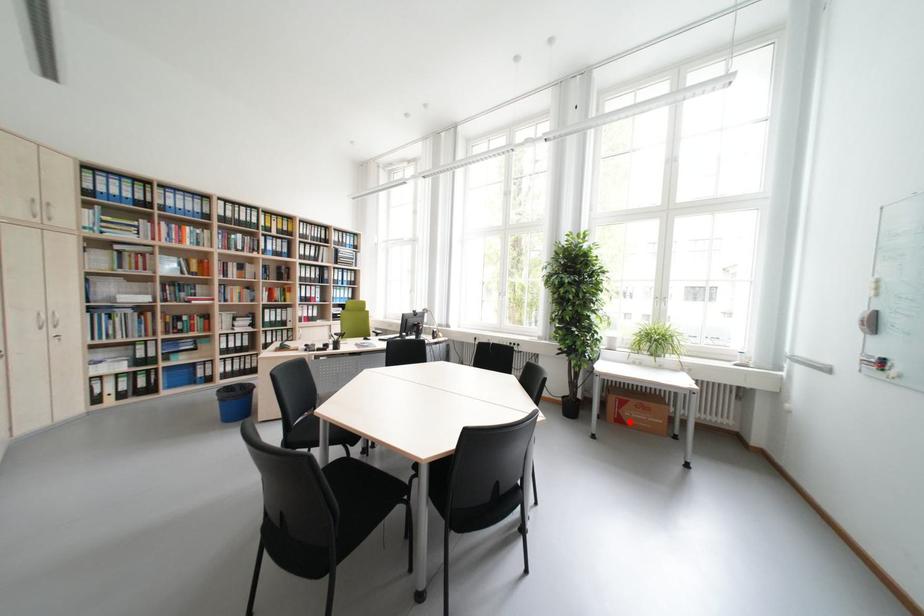
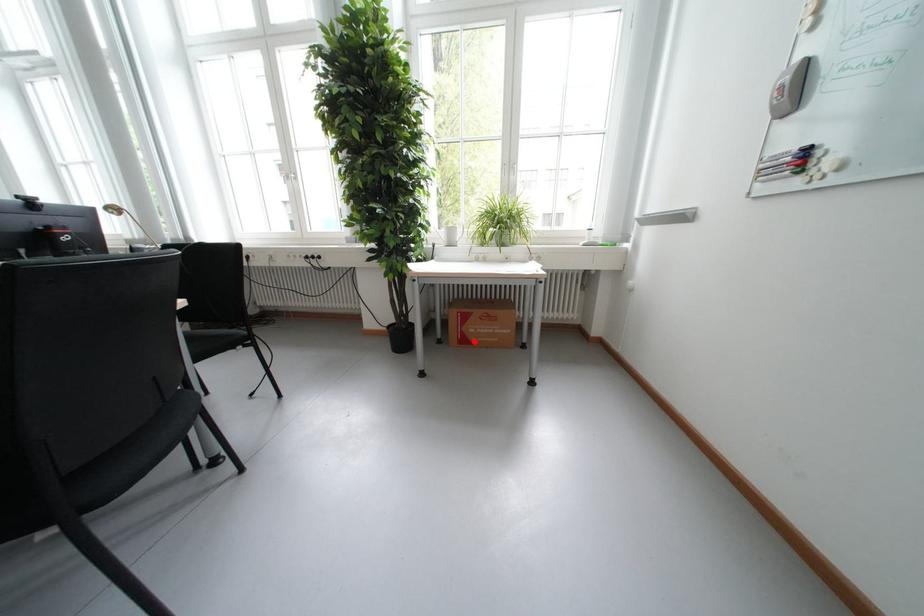
I am providing you with two images of the same scene from different viewpoints. A red point is marked on the first image and another point is marked on the second image. Is the marked point in image1 the same physical position as the marked point in image2?

Yes